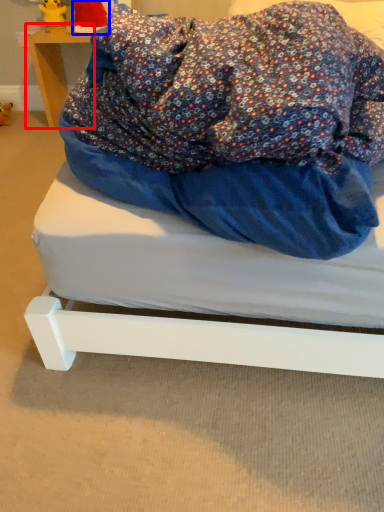
Question: Which object appears closest to the camera in this image, furniture (highlighted by a red box) or toy (highlighted by a blue box)?

Choices:
 (A) furniture
 (B) toy

Answer: (B)